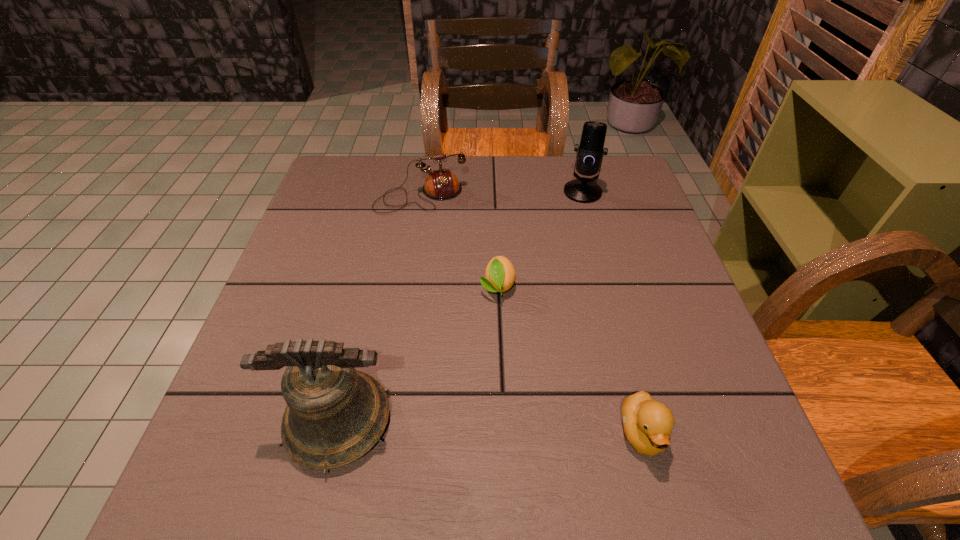
Find the location of a particular element. free space on the desktop that is between the bell and the duckling and is positioned with leaves positioned above the third nearest object is located at coordinates (505, 428).

Find the location of `free space on the desktop that is between the bell and the duckling and is positioned on the stand of the microphone`. free space on the desktop that is between the bell and the duckling and is positioned on the stand of the microphone is located at coordinates (445, 426).

Find the location of `vacant space on the desktop that is between the bell and the duckling and is positioned on the rotary dial of the telephone`. vacant space on the desktop that is between the bell and the duckling and is positioned on the rotary dial of the telephone is located at coordinates (491, 427).